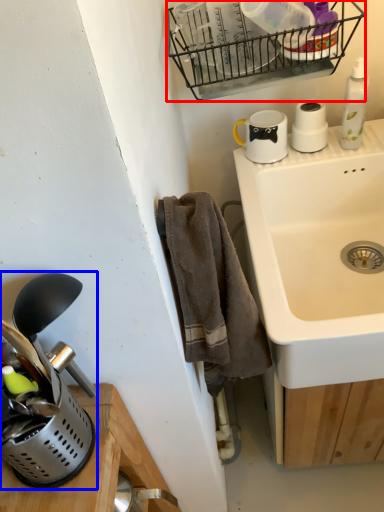
Question: Among these objects, which one is farthest to the camera, basket (highlighted by a red box) or appliance (highlighted by a blue box)?

Choices:
 (A) basket
 (B) appliance

Answer: (A)